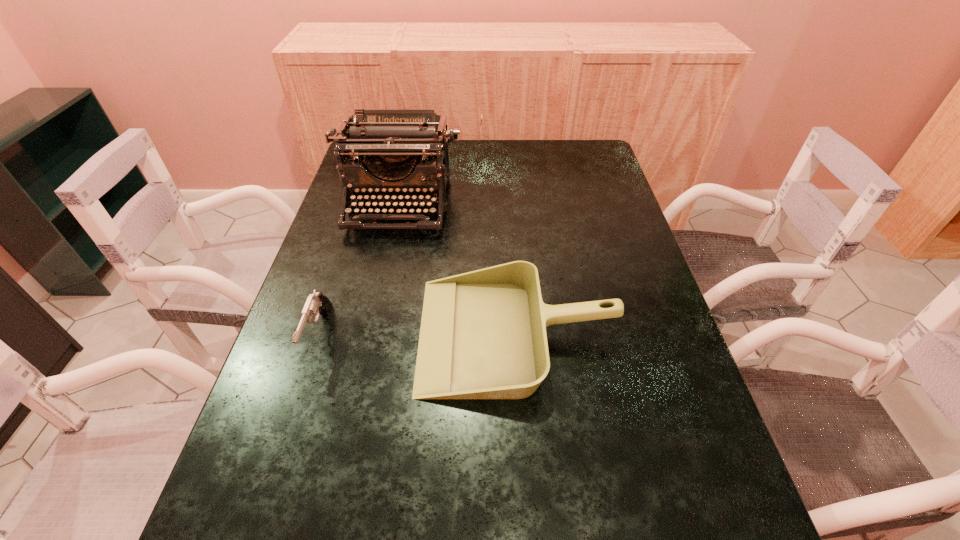
What are the coordinates of `typewriter positioned at the left edge` in the screenshot? It's located at (401, 137).

Locate an element on the screen. gun situated at the left edge is located at coordinates (316, 303).

In order to click on object that is at the right edge in this screenshot , I will do `click(483, 335)`.

Find the location of a particular element. The image size is (960, 540). object at the far left corner is located at coordinates [401, 137].

In the image, there is a desktop. Identify the location of vacant space at the far edge. (492, 153).

Locate an element on the screen. Image resolution: width=960 pixels, height=540 pixels. vacant space at the left edge is located at coordinates (381, 232).

At what (x,y) coordinates should I click in order to perform the action: click on vacant region at the right edge. Please return your answer as a coordinate pair (x, y). The width and height of the screenshot is (960, 540). Looking at the image, I should click on [588, 211].

Where is `free space between the tallest object and the dustpan`? The width and height of the screenshot is (960, 540). free space between the tallest object and the dustpan is located at coordinates (458, 269).

Locate an element on the screen. The height and width of the screenshot is (540, 960). free space between the gun and the farthest object is located at coordinates (358, 269).

Where is `vacant area that lies between the dustpan and the tallest object`? The image size is (960, 540). vacant area that lies between the dustpan and the tallest object is located at coordinates (458, 269).